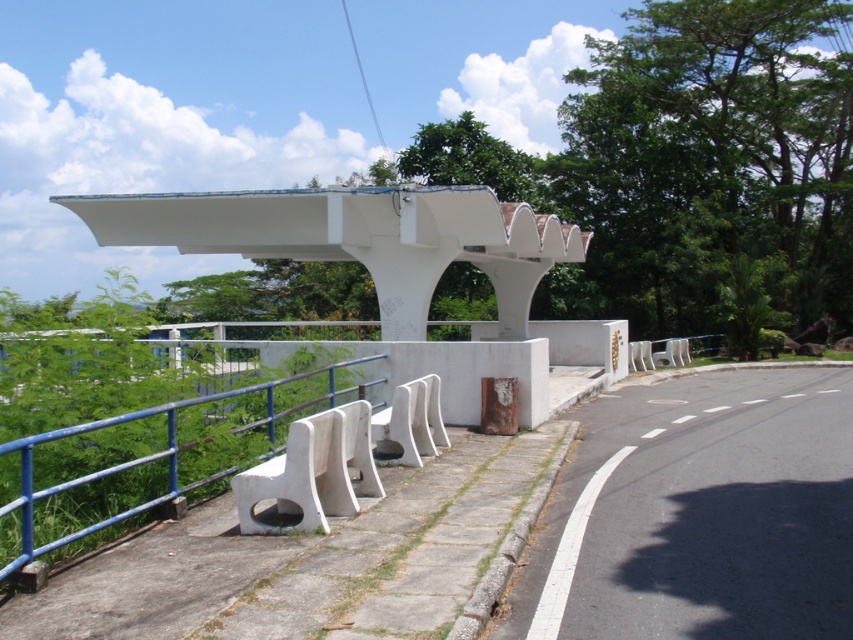
You are planning to install a new bench that is 1.5 meters wide. The white matte overpass at center and the white plastic rail at lower left are in the way. Which object might you need to adjust to accommodate the bench?

The white matte overpass at center has a larger width than the white plastic rail at lower left. Since the bench is 1.5 meters wide, you should adjust the white matte overpass at center to accommodate the bench because its width is greater and may provide more space for modification.

You are a visitor at this rest stop and want to take a photo of the white matte overpass at center and the white plastic rail at lower left. Which object should you focus on first if you want to include both in the frame without moving the camera?

The white matte overpass at center is larger in size than the white plastic rail at lower left, so you should focus on the white matte overpass at center first to ensure it fits properly in the frame before adjusting for the smaller rail.

You are standing at the viewpoint and want to take a photo of the white matte overpass at center. If you move 10 feet closer, will the overpass fill more of your camera frame?

The white matte overpass at center is currently 42.68 feet away. Moving 10 feet closer would reduce the distance to 32.68 feet, making the overpass appear larger in the camera frame. Yes, it will fill more of the frame.